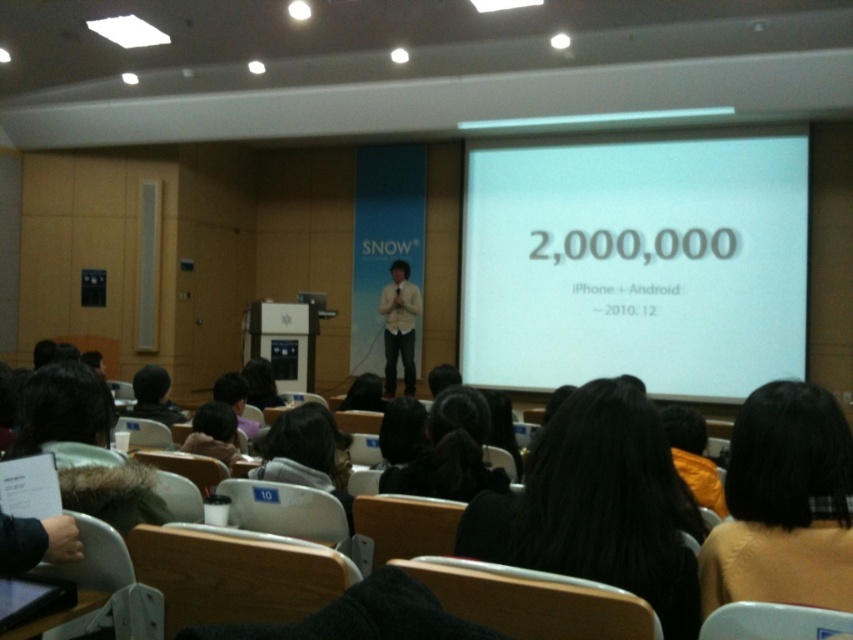
Is point (491, 161) positioned before point (405, 368)?

No, it is not.

Between white matte projection screen at center and light beige shirt at center, which one appears on the left side from the viewer's perspective?

From the viewer's perspective, light beige shirt at center appears more on the left side.

Between point (642, 324) and point (410, 323), which one is positioned in front?

Positioned in front is point (642, 324).

This screenshot has width=853, height=640. I want to click on white matte projection screen at center, so click(x=636, y=262).

Which is more to the right, black hair at center or light brown sweater at lower right?

light brown sweater at lower right

Can you confirm if black hair at center is positioned above light brown sweater at lower right?

No.

Who is more distant from viewer, (585,464) or (747,545)?

The point (585,464) is behind.

The image size is (853, 640). Find the location of `black hair at center`. black hair at center is located at coordinates (598, 506).

Between white matte projection screen at center and black hair at center, which one is positioned lower?

black hair at center is below.

Does white matte projection screen at center have a greater width compared to black hair at center?

Correct, the width of white matte projection screen at center exceeds that of black hair at center.

The height and width of the screenshot is (640, 853). Describe the element at coordinates (636, 262) in the screenshot. I see `white matte projection screen at center` at that location.

Image resolution: width=853 pixels, height=640 pixels. I want to click on white matte projection screen at center, so click(x=636, y=262).